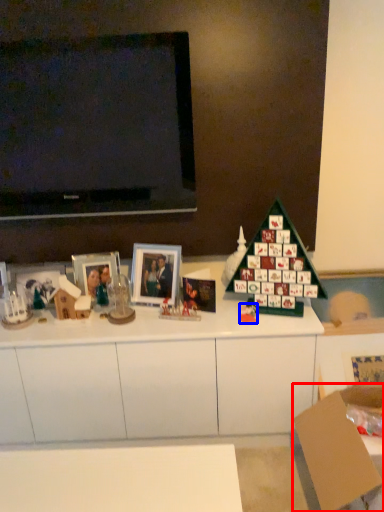
Question: Among these objects, which one is farthest to the camera, cardboard box (highlighted by a red box) or toy (highlighted by a blue box)?

Choices:
 (A) cardboard box
 (B) toy

Answer: (B)